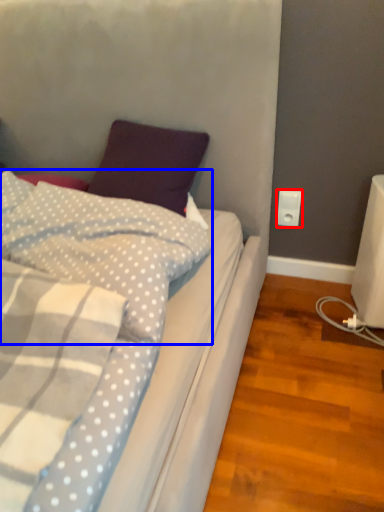
Question: Which object appears farthest to the camera in this image, power plugs and sockets (highlighted by a red box) or pillow (highlighted by a blue box)?

Choices:
 (A) power plugs and sockets
 (B) pillow

Answer: (A)